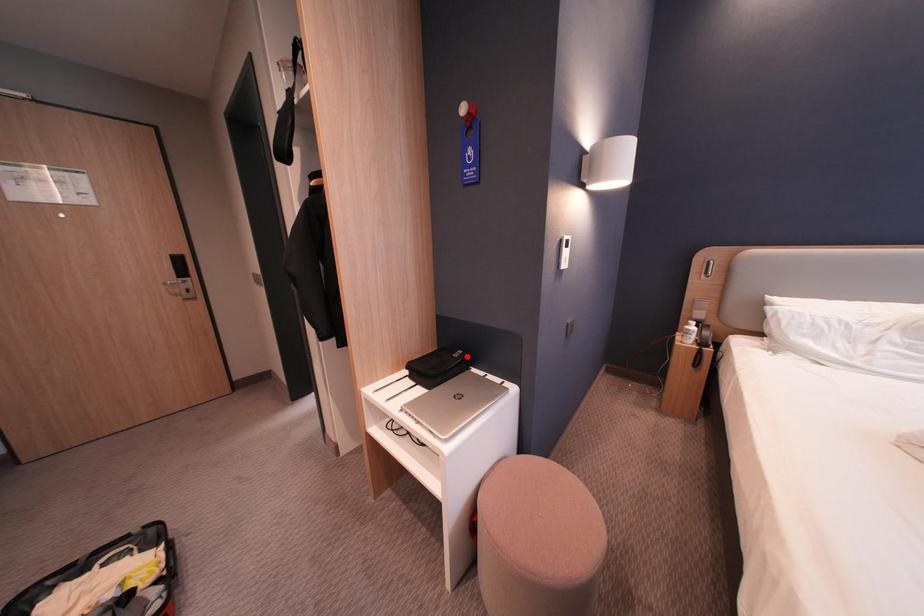
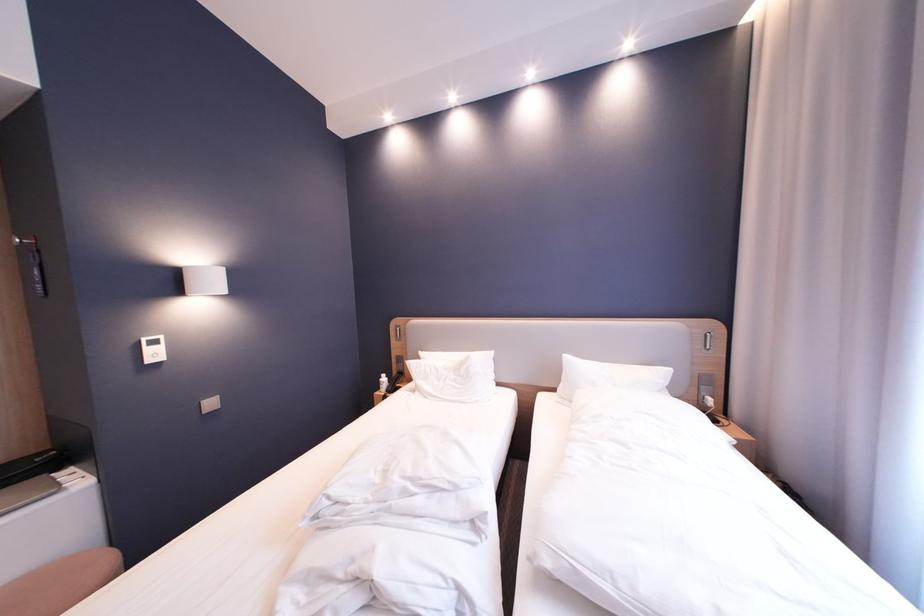
Question: I am providing you with two images of the same scene from different viewpoints. In image1, a red point is highlighted. Considering the same 3D point in image2, which of the following is correct?

Choices:
 (A) It is closer
 (B) It is farther

Answer: (A)